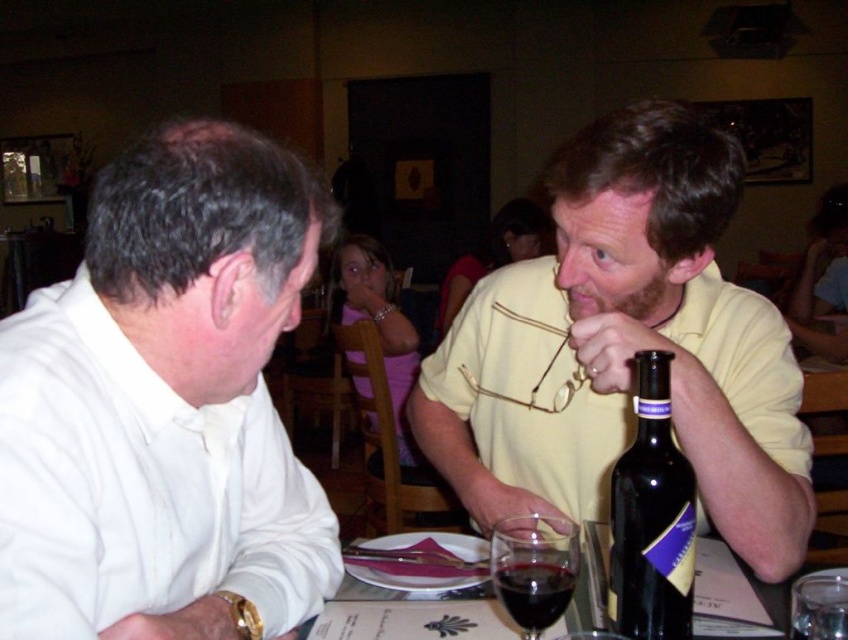
Looking at this image, between dark glass bottle at right and dark glass wine at lower center, which one has less height?

With less height is dark glass wine at lower center.

Is dark glass bottle at right thinner than dark glass wine at lower center?

No.

Is point (671, 442) less distant than point (544, 609)?

No, it is behind (544, 609).

This screenshot has width=848, height=640. Identify the location of dark glass bottle at right. (651, 516).

Based on the photo, is white matte shirt at left bigger than transparent glass at lower center?

Correct, white matte shirt at left is larger in size than transparent glass at lower center.

Is point (71, 484) behind point (530, 588)?

No, (71, 484) is closer to viewer.

What do you see at coordinates (165, 403) in the screenshot?
I see `white matte shirt at left` at bounding box center [165, 403].

In order to click on white matte shirt at left in this screenshot , I will do `click(165, 403)`.

Who is higher up, yellow matte shirt at right or dark glass bottle at right?

Positioned higher is yellow matte shirt at right.

Does point (778, 509) lie in front of point (650, 627)?

No, (778, 509) is further to viewer.

In order to click on yellow matte shirt at right in this screenshot , I will do `click(625, 348)`.